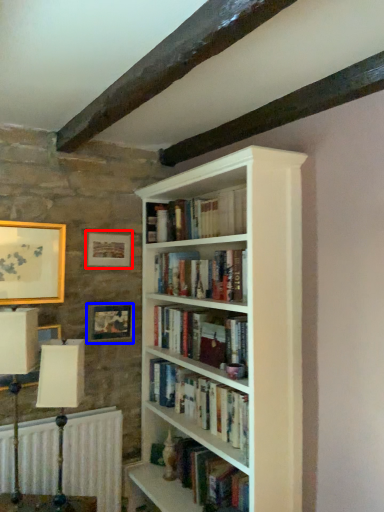
Question: Which of the following is the closest to the observer, picture frame (highlighted by a red box) or picture frame (highlighted by a blue box)?

Choices:
 (A) picture frame
 (B) picture frame

Answer: (B)